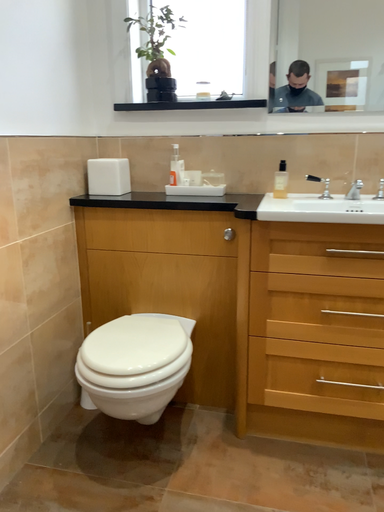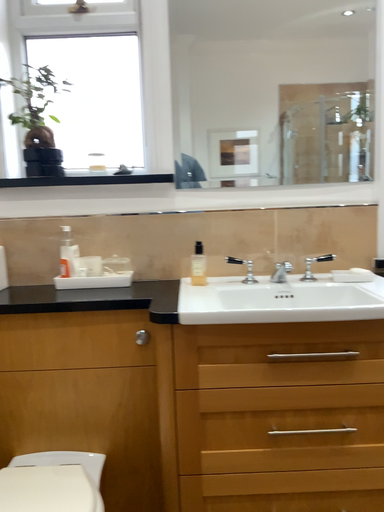
Question: Which way did the camera rotate in the video?

Choices:
 (A) rotated left
 (B) rotated right

Answer: (B)